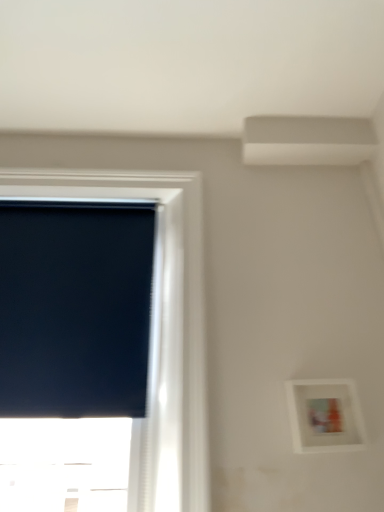
Question: Can you confirm if black matte window screen at left is wider than white matte picture frame at lower right?

Choices:
 (A) no
 (B) yes

Answer: (A)

Question: Does black matte window screen at left have a greater height compared to white matte picture frame at lower right?

Choices:
 (A) yes
 (B) no

Answer: (A)

Question: Is black matte window screen at left directly adjacent to white matte picture frame at lower right?

Choices:
 (A) yes
 (B) no

Answer: (B)

Question: From the image's perspective, is black matte window screen at left on top of white matte picture frame at lower right?

Choices:
 (A) no
 (B) yes

Answer: (B)

Question: Is black matte window screen at left at the left side of white matte picture frame at lower right?

Choices:
 (A) yes
 (B) no

Answer: (A)

Question: Would you consider black matte window screen at left to be distant from white matte picture frame at lower right?

Choices:
 (A) yes
 (B) no

Answer: (B)

Question: Is white matte picture frame at lower right aimed at black matte window at left?

Choices:
 (A) no
 (B) yes

Answer: (A)

Question: Is white matte picture frame at lower right in contact with black matte window at left?

Choices:
 (A) yes
 (B) no

Answer: (B)

Question: Can you confirm if white matte picture frame at lower right is taller than black matte window at left?

Choices:
 (A) yes
 (B) no

Answer: (B)

Question: Is white matte picture frame at lower right at the left side of black matte window at left?

Choices:
 (A) no
 (B) yes

Answer: (A)

Question: From the image's perspective, does white matte picture frame at lower right appear lower than black matte window at left?

Choices:
 (A) no
 (B) yes

Answer: (B)

Question: Is white matte picture frame at lower right surrounding black matte window at left?

Choices:
 (A) yes
 (B) no

Answer: (B)

Question: Can you confirm if black matte window screen at left is wider than black matte window at left?

Choices:
 (A) no
 (B) yes

Answer: (A)